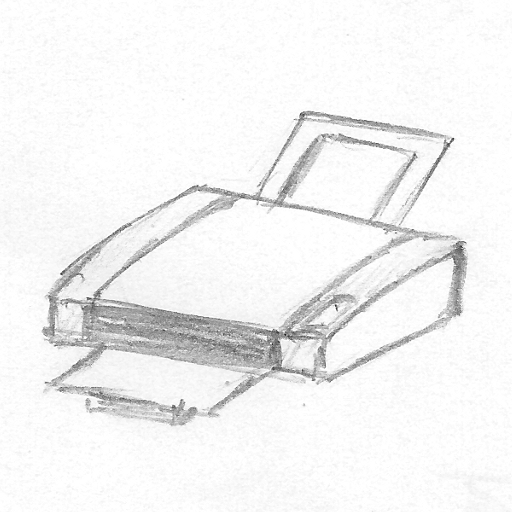
Locate an element on the screen. top of printer is located at coordinates click(x=113, y=256).